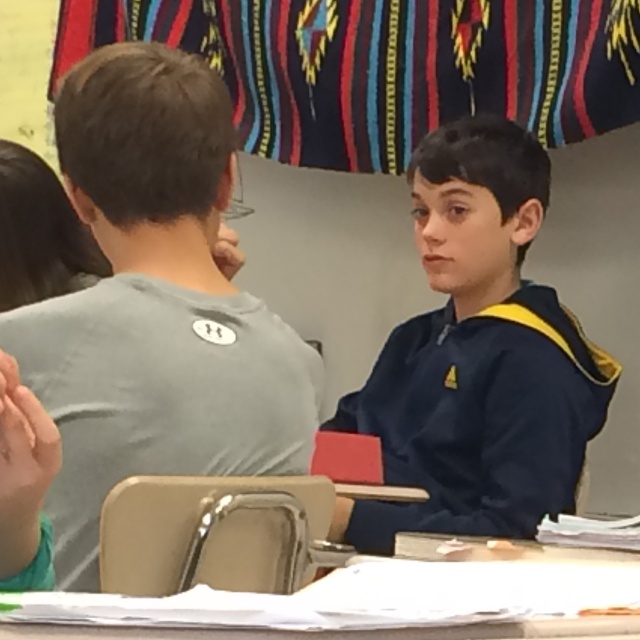
What are the coordinates of the navy blue hoodie at center?

The navy blue hoodie at center is located at point (477, 356).

You are a teacher standing at the front of the classroom. You notice a navy blue hoodie at center that belongs to a student. If the hoodie is 7.72 feet away from you, can you reach it without moving from your current position?

The navy blue hoodie at center is 7.72 feet away from the camera, so the teacher cannot reach it without moving closer.

Consider the image. You are a student trying to reach the pencil case on the white plastic table at lower center. The navy blue hoodie at center is blocking your view. Can you reach the pencil case without moving the hoodie?

The navy blue hoodie at center is further to the viewer than the white plastic table at lower center, so it is blocking the path. You would need to move the hoodie to access the pencil case.